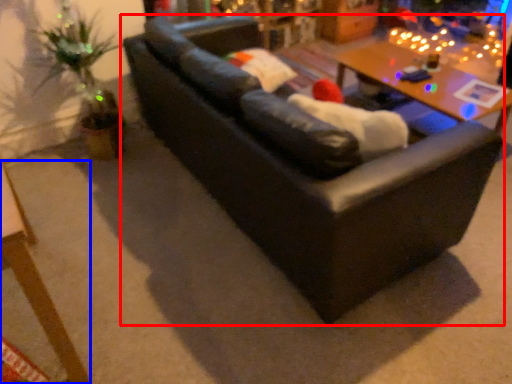
Question: Which object is closer to the camera taking this photo, studio couch (highlighted by a red box) or table (highlighted by a blue box)?

Choices:
 (A) studio couch
 (B) table

Answer: (B)